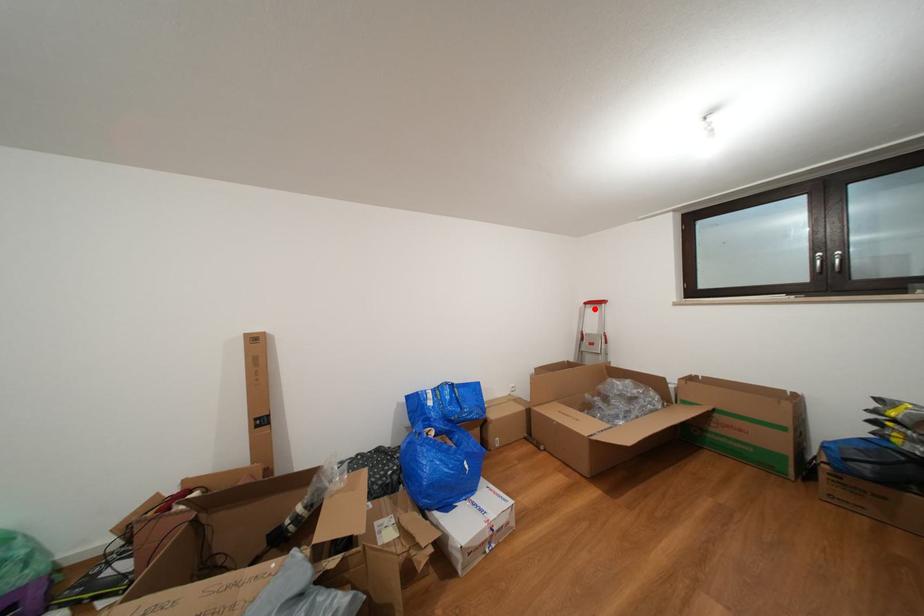
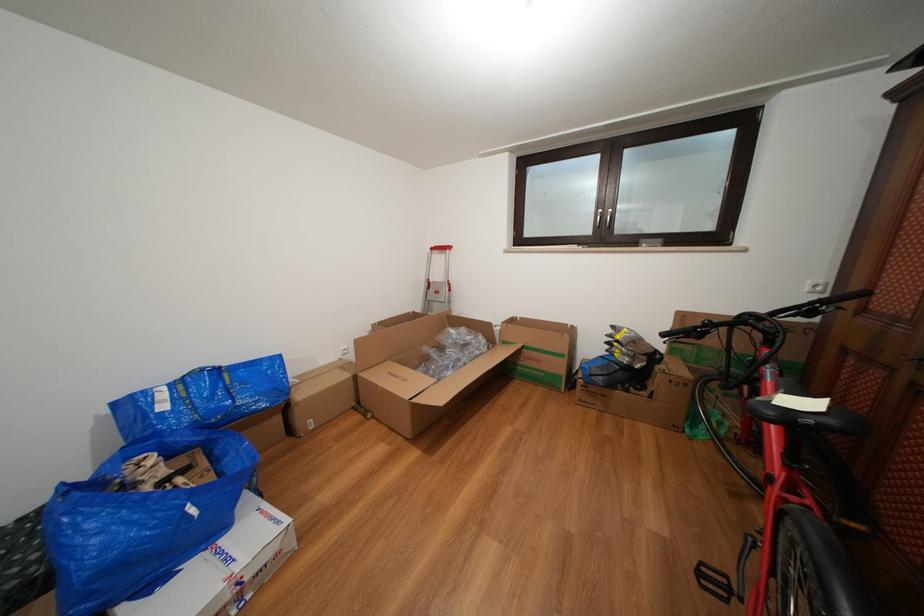
Question: A red point is marked in image1. In image2, is the corresponding 3D point closer to the camera or farther? Reply with the corresponding letter.

Choices:
 (A) The corresponding 3D point is closer.
 (B) The corresponding 3D point is farther.

Answer: (A)